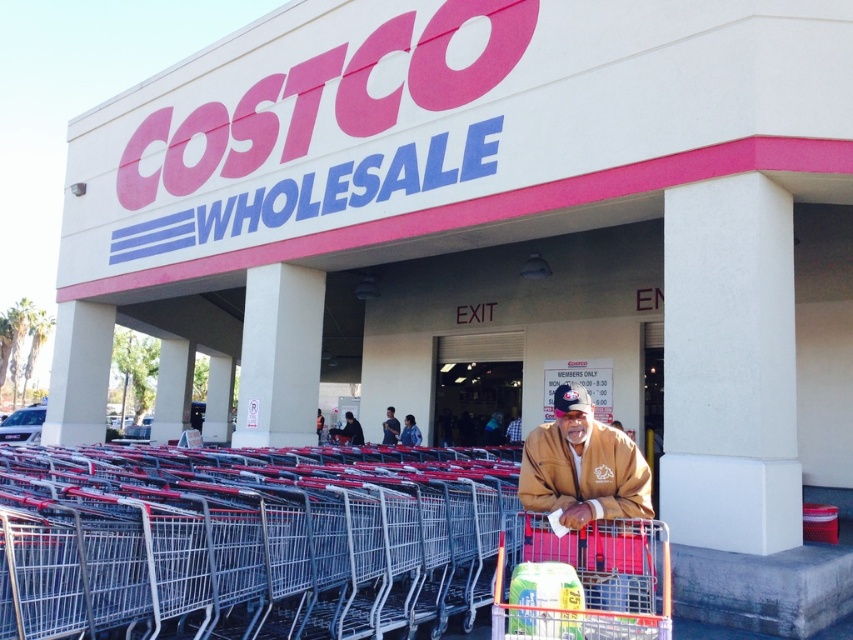
You are standing in front of the Costco store and notice a metallic silver shopping cart at center and a brown leather jacket at center. Which object is taller?

The brown leather jacket at center is taller than the metallic silver shopping cart at center.

You are standing at the entrance of the Costco store and notice a man in a brown suede jacket at lower right. Where exactly is the brown suede jacket positioned relative to the red shopping carts?

The brown suede jacket at lower right is located at point coordinates of (589, 499), which places it near the lower right area of the image, positioned to the right side of the red shopping carts lined up in front of the store.